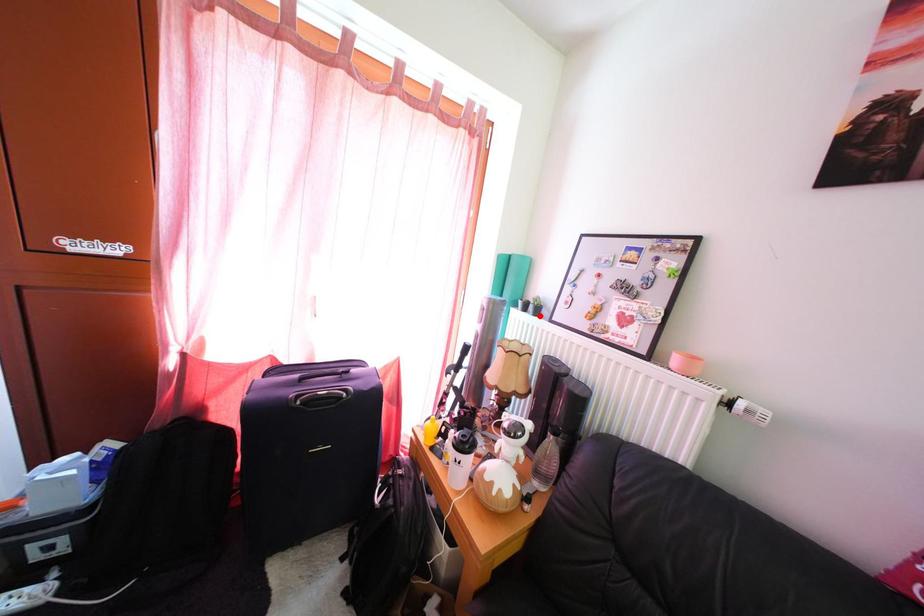
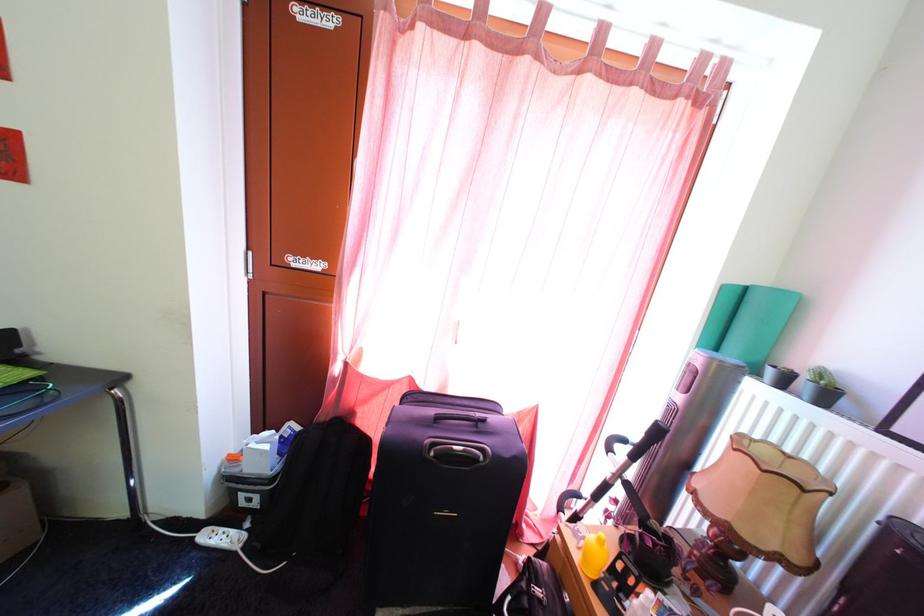
Where in the second image is the point corresponding to the highlighted location from the first image?

(813, 395)